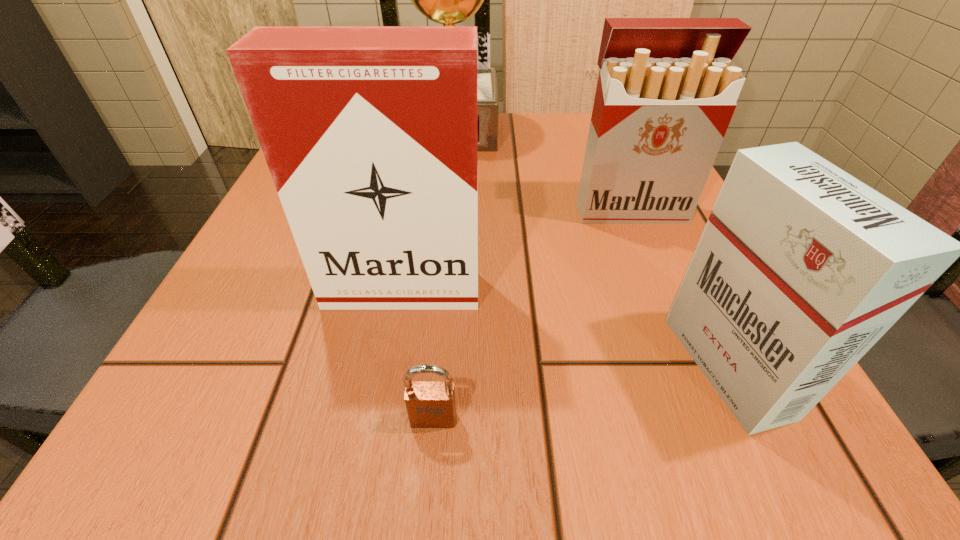
Find the location of a particular element. the farthest object is located at coordinates (448, 0).

Locate an element on the screen. The height and width of the screenshot is (540, 960). the second farthest cigarette case is located at coordinates (370, 133).

Image resolution: width=960 pixels, height=540 pixels. Identify the location of the leftmost cigarette case. (370, 133).

Image resolution: width=960 pixels, height=540 pixels. Find the location of `the second farthest object`. the second farthest object is located at coordinates (667, 88).

Identify the location of the shortest cigarette case. This screenshot has height=540, width=960. (801, 268).

What are the coordinates of `the nearest cigarette case` in the screenshot? It's located at (801, 268).

You are a GUI agent. You are given a task and a screenshot of the screen. Output one action in this format:
    pyautogui.click(x=<x>, y=<y>)
    Task: Click on the padlock
    
    Given the screenshot: What is the action you would take?
    pyautogui.click(x=430, y=404)

I want to click on vacant space located on the front-facing side of the award, so click(440, 281).

Identify the location of free space located on the front-facing side of the leftmost cigarette case. This screenshot has width=960, height=540. (389, 364).

Locate an element on the screen. This screenshot has width=960, height=540. free spot located with the lid open on the fourth nearest object is located at coordinates [x=678, y=325].